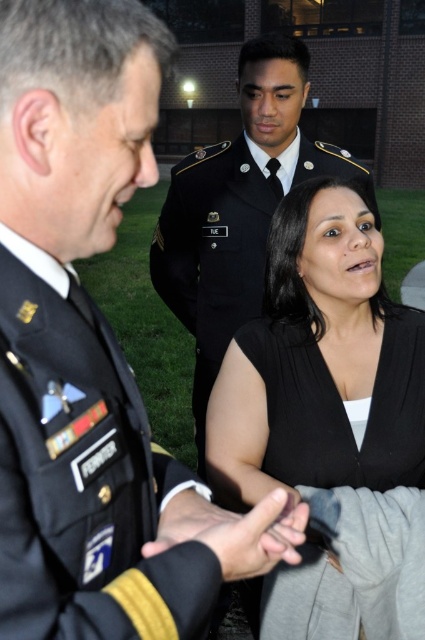
You are an observer trying to determine if the two hands in the scene are the same object. Based on the spatial relationship between the black matte hand at center and the matte black hand at center, can you confirm if they are the same object?

The black matte hand at center might be wider than matte black hand at center, so they are likely different objects.

You are a photographer trying to capture a closeup shot of the dark blue fabric military uniform at center and the black matte hand at center. Given that your camera has a minimum focusing distance of 5 inches, will you be able to take the photo without moving closer?

The distance between the dark blue fabric military uniform at center and the black matte hand at center is 5.34 inches, which is slightly more than the camera minimum focusing distance of 5 inches. Therefore, you can take the photo without moving closer.

You are a photographer at the event and need to capture a photo where both the dark blue fabric military uniform at center and the dark green military uniform at center are clearly visible. Given their current positions, which one should you focus on first to ensure both are in frame?

The dark blue fabric military uniform at center is positioned under the dark green military uniform at center, so focusing on the dark green military uniform at center first would allow the camera to adjust for depth and ensure both are in focus.